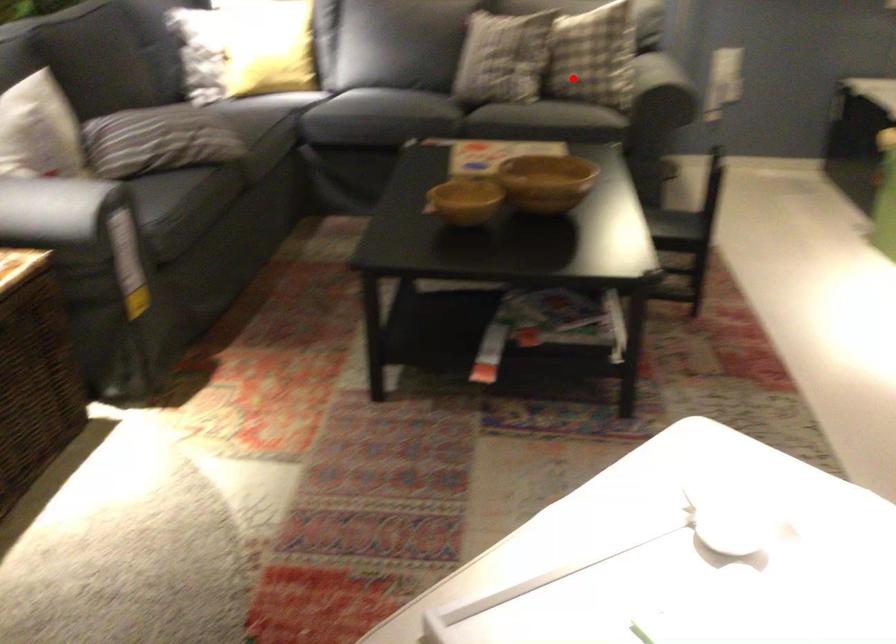
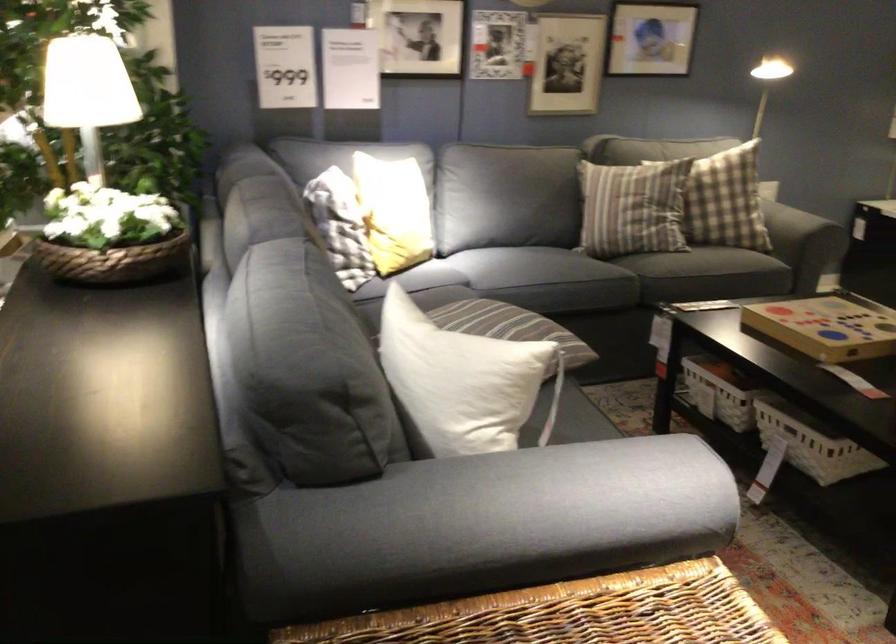
Find the pixel in the second image that matches the highlighted location in the first image.

(798, 223)